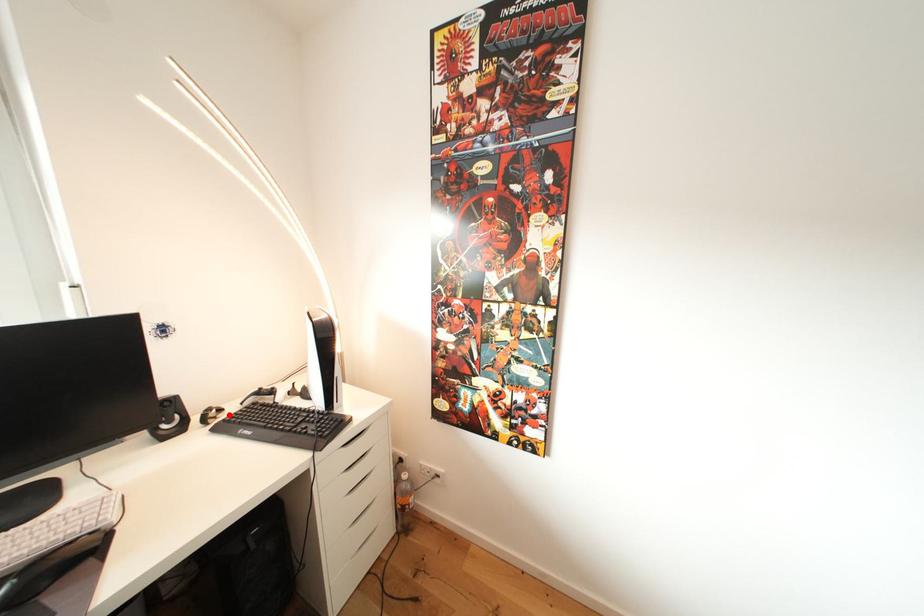
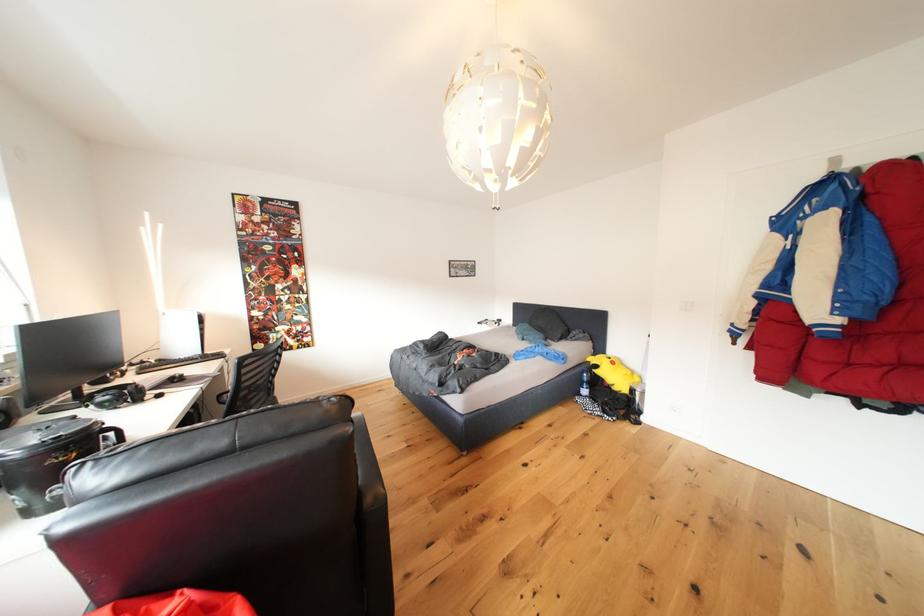
Question: I am providing you with two images of the same scene from different viewpoints. A red point is marked on the first image. Can you still see the location of the red point in image 2?

Choices:
 (A) Yes
 (B) No

Answer: (B)